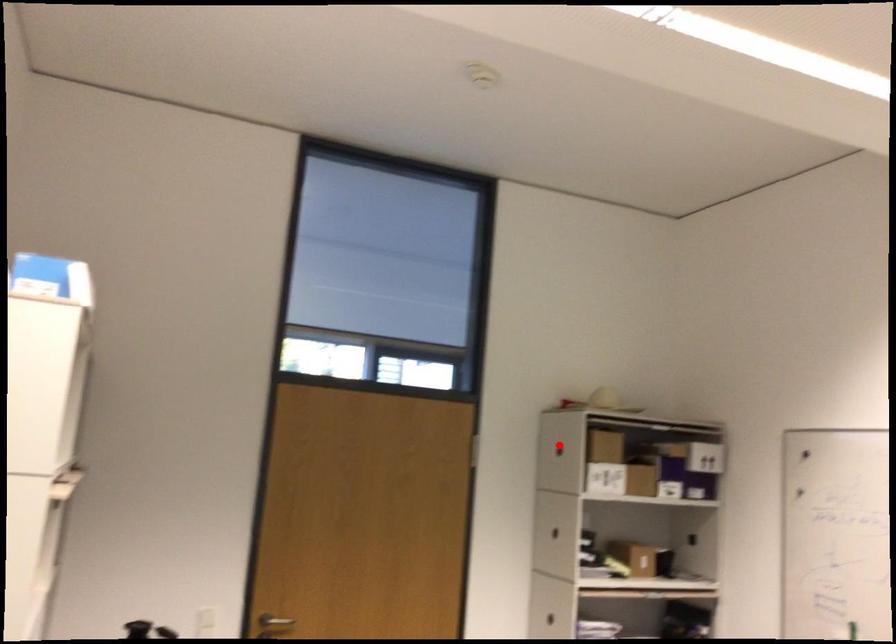
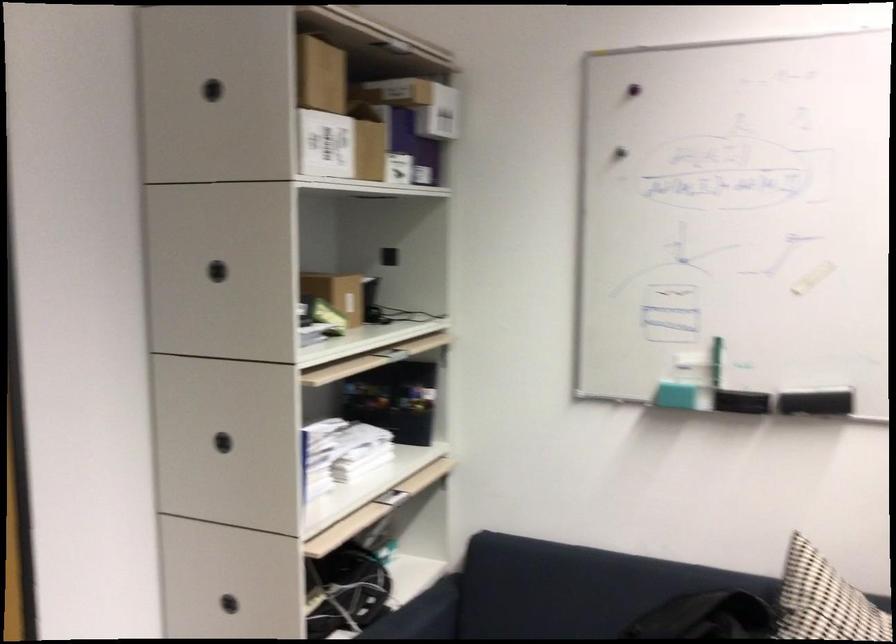
Where in the second image is the point corresponding to the highlighted location from the first image?

(211, 90)